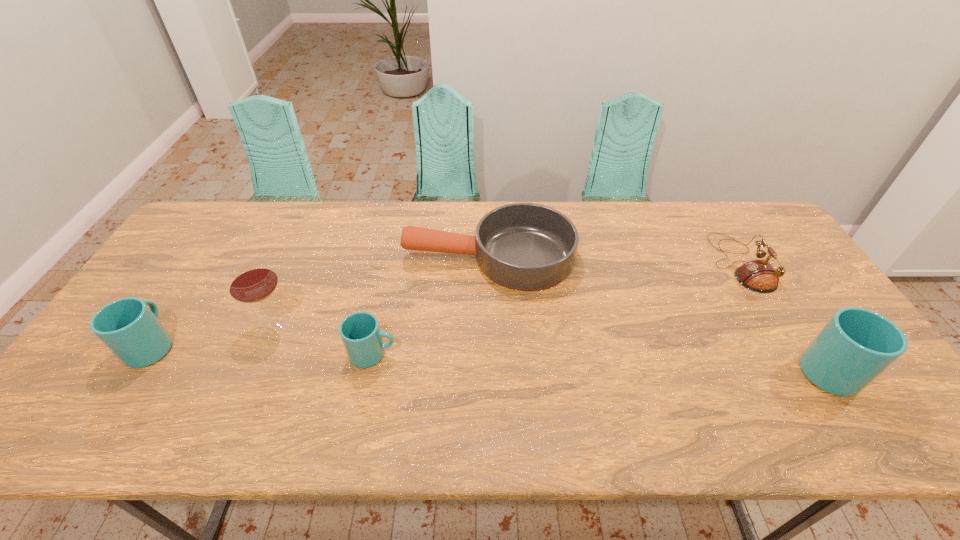
This screenshot has width=960, height=540. Identify the location of the leftmost object. (128, 327).

This screenshot has height=540, width=960. I want to click on the leftmost cup, so click(x=128, y=327).

I want to click on the shortest cup, so click(360, 332).

You are a GUI agent. You are given a task and a screenshot of the screen. Output one action in this format:
    pyautogui.click(x=<x>, y=<y>)
    Task: Click on the fifth shortest object
    This screenshot has height=540, width=960.
    Given the screenshot: What is the action you would take?
    pyautogui.click(x=856, y=345)

Where is `the rightmost cup`? The height and width of the screenshot is (540, 960). the rightmost cup is located at coordinates (856, 345).

Where is `pan`? pan is located at coordinates (524, 246).

I want to click on wineglass, so click(x=252, y=280).

Locate an element on the screen. telephone is located at coordinates (759, 276).

The height and width of the screenshot is (540, 960). Find the location of `vacant space positioned on the handle side of the third tallest object`. vacant space positioned on the handle side of the third tallest object is located at coordinates (188, 289).

Identify the location of free space located on the handle side of the third tallest object. The width and height of the screenshot is (960, 540). coord(204,266).